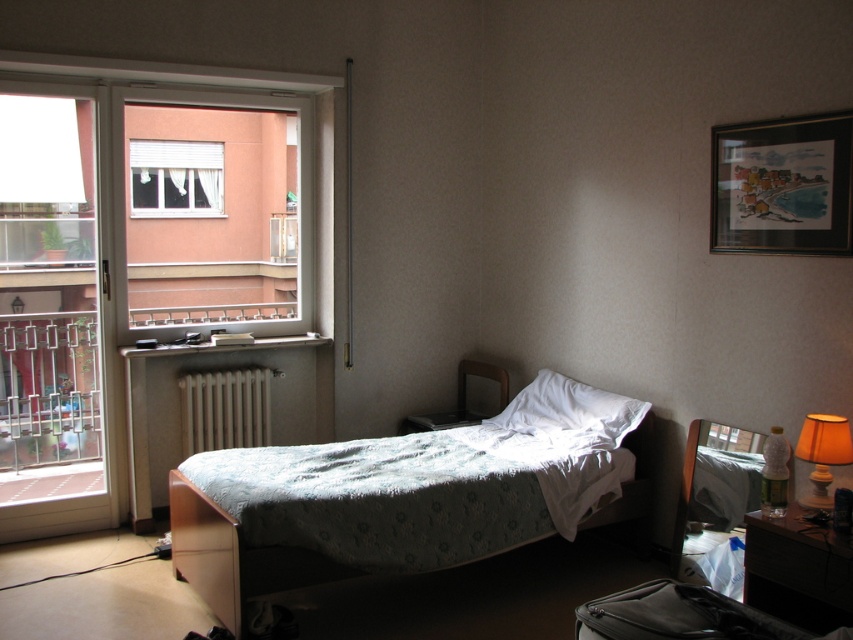
You are a delivery person who needs to place a package on the bed. The package is 2 meters long. Will the package fit on the light blue quilted bed at center?

The package is 2 meters long and the bed is 2.73 meters long, so the package will fit on the light blue quilted bed at center.

Consider the image. You are organizing your bedroom and want to move a plant from the nightstand to a spot between the matte wooden dresser at lower right and the white soft pillow at center. Based on their positions, can you place the plant exactly in the middle between them?

The matte wooden dresser at lower right is to the right of the white soft pillow at center, so placing the plant exactly in the middle between them would require positioning it halfway between the two objects along the horizontal axis.

You are a delivery robot with a package that is 1.0 meters wide. You need to move from the door to the bedside table. Is there enough space between the matte wooden dresser at lower right and the white soft pillow at center for the package to pass through?

The distance between the matte wooden dresser at lower right and the white soft pillow at center is 1.07 meters. Since the package is 1.0 meters wide, there is enough space for the package to pass through.